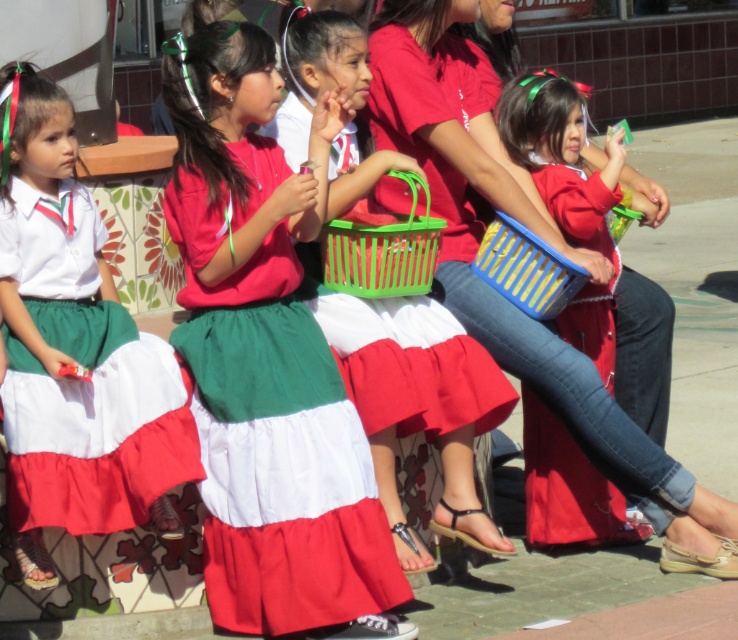
Where is the matte plastic basket at center located in the image?

The matte plastic basket at center is located at point (420, 404) in the image.

You are a photographer taking pictures of the children holding baskets. You notice two baskets at the center of the scene. Which basket is on the left side when looking at the matte plastic basket at center and the blue plastic basket at center?

The matte plastic basket at center is positioned on the left side of the blue plastic basket at center.